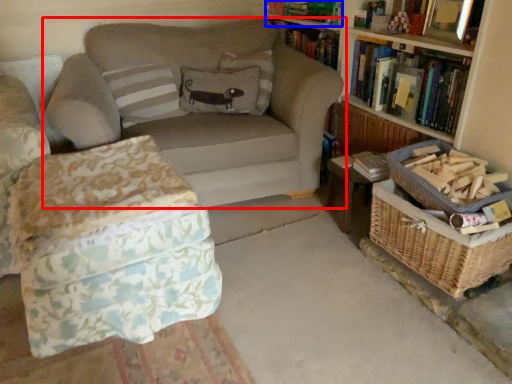
Question: Which of the following is the closest to the observer, studio couch (highlighted by a red box) or book (highlighted by a blue box)?

Choices:
 (A) studio couch
 (B) book

Answer: (A)